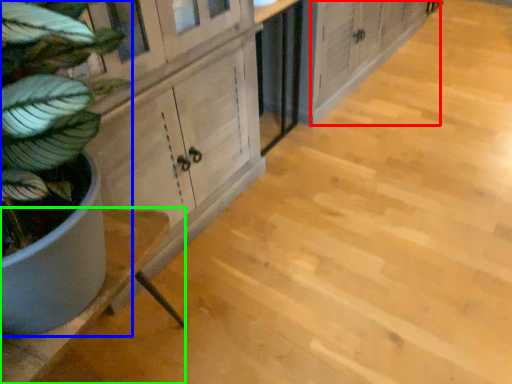
Question: Which object is the farthest from cabinetry (highlighted by a red box)? Choose among these: houseplant (highlighted by a blue box) or counter (highlighted by a green box).

Choices:
 (A) houseplant
 (B) counter

Answer: (A)